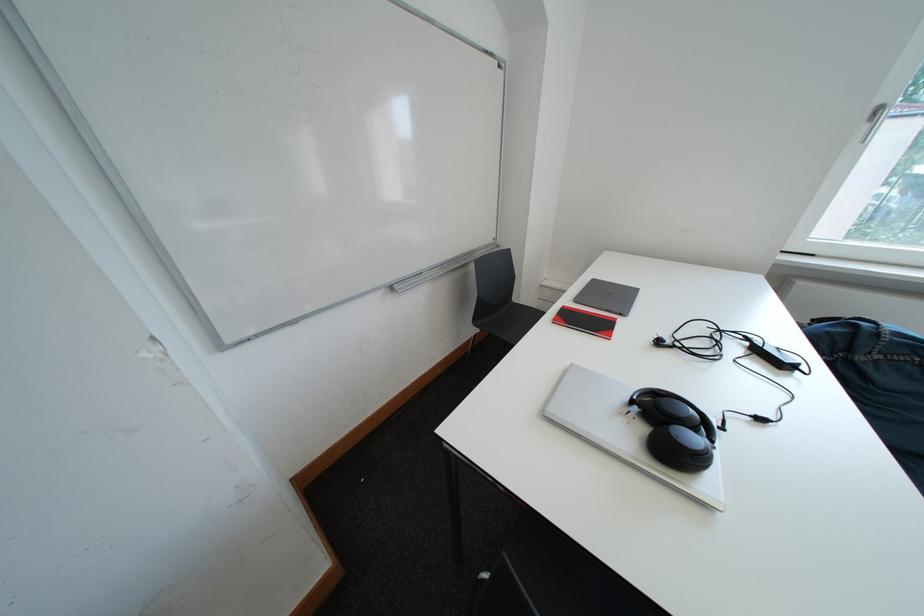
Find where to lift the red and black notebook. Please return your answer as a coordinate pair (x, y).

(585, 321)